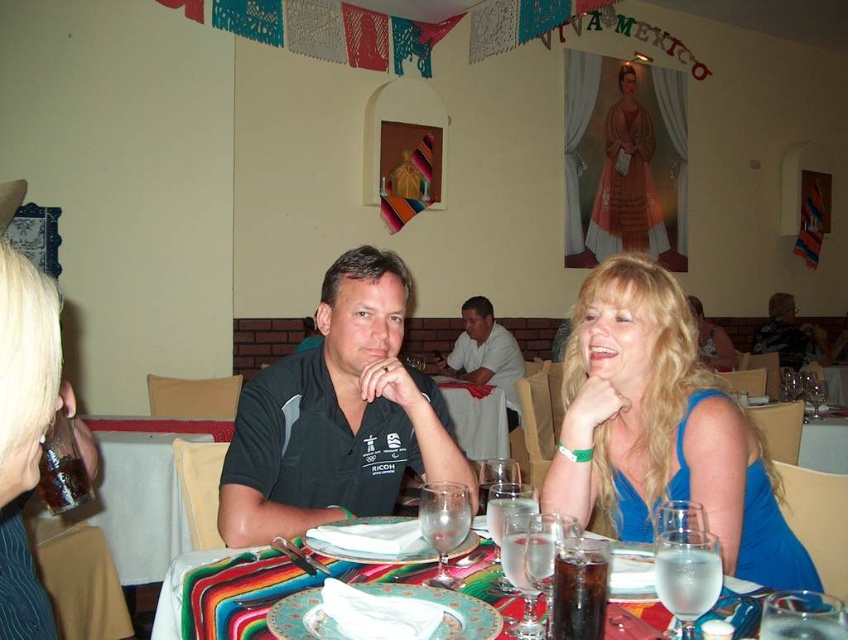
Question: Which point appears farthest from the camera in this image?

Choices:
 (A) (236, 586)
 (B) (721, 326)

Answer: (B)

Question: Is multicolored woven placemat at center positioned in front of translucent glass water at center?

Choices:
 (A) no
 (B) yes

Answer: (B)

Question: Which of the following is the closest to the observer?

Choices:
 (A) (280, 384)
 (B) (483, 452)

Answer: (A)

Question: Can you confirm if black matte shirt at center is positioned to the right of matte black shirt at center?

Choices:
 (A) no
 (B) yes

Answer: (A)

Question: Which point is farther to the camera?

Choices:
 (A) multicolored woven placemat at center
 (B) matte black shirt at center
 (C) translucent glass water at center
 (D) blue satin dress at center

Answer: (B)

Question: Is blue satin dress at center in front of blue fabric dress at center?

Choices:
 (A) no
 (B) yes

Answer: (B)